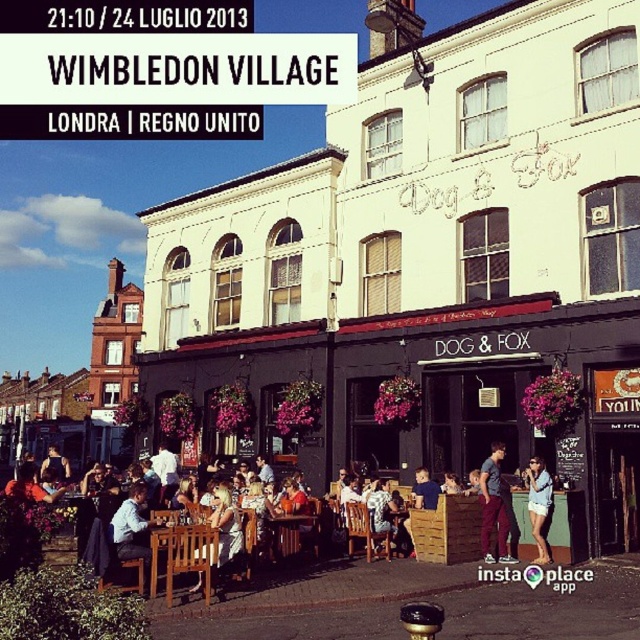
Who is more forward, (x=209, y=540) or (x=417, y=506)?

Point (x=209, y=540) is in front.

Is brown wooden table at center shorter than matte blue shirt at center?

No.

Looking at this image, measure the distance between point (150, 564) and camera.

A distance of 33.39 meters exists between point (150, 564) and camera.

Identify the location of brown wooden table at center. This screenshot has height=640, width=640. (182, 556).

You are a GUI agent. You are given a task and a screenshot of the screen. Output one action in this format:
    pyautogui.click(x=<x>, y=<y>)
    Task: Click on the wooden table at center
    The height and width of the screenshot is (640, 640).
    Given the screenshot: What is the action you would take?
    pyautogui.click(x=292, y=534)

Between wooden table at center and matte black jacket at center, which one has less height?

matte black jacket at center is shorter.

Is point (276, 552) positioned in front of point (445, 484)?

Yes, it is.

Identify the location of wooden table at center. The height and width of the screenshot is (640, 640). (292, 534).

Which is behind, point (154, 572) or point (544, 502)?

The point (544, 502) is behind.

Identify the location of brown wooden table at center. Image resolution: width=640 pixels, height=640 pixels. (182, 556).

This screenshot has height=640, width=640. I want to click on brown wooden table at center, so click(182, 556).